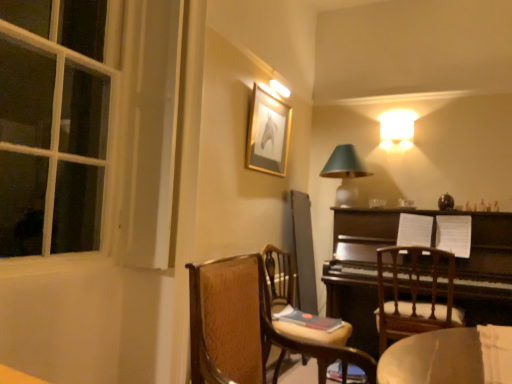
Find the location of `free point above gold-framed picture at upper center (from a real-world perspective)`. free point above gold-framed picture at upper center (from a real-world perspective) is located at coordinates (269, 96).